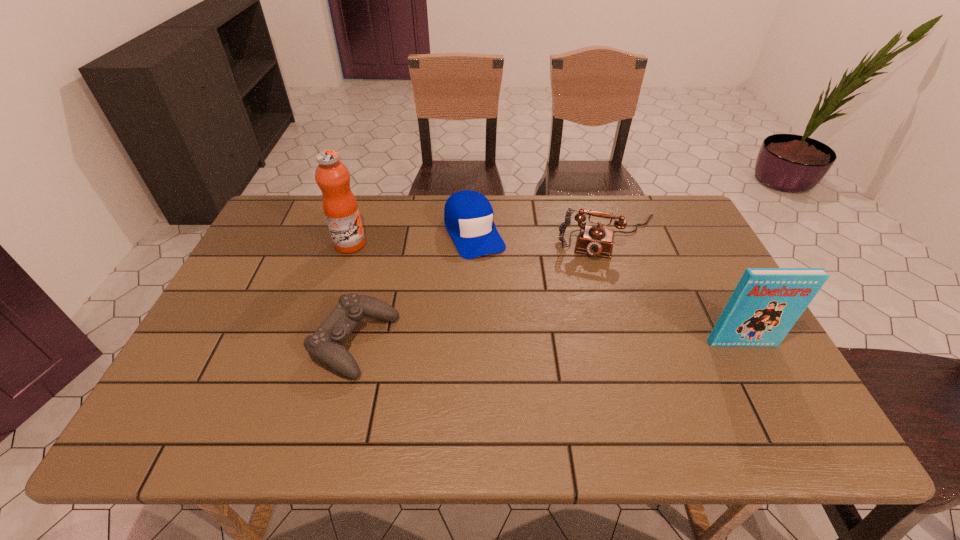
You are a GUI agent. You are given a task and a screenshot of the screen. Output one action in this format:
    pyautogui.click(x=<x>, y=<y>)
    Task: Click on the free space on the desktop that is between the control and the book and is positioned on the dial of the telephone
    This screenshot has width=960, height=540.
    Given the screenshot: What is the action you would take?
    pyautogui.click(x=597, y=343)

The width and height of the screenshot is (960, 540). Find the location of `free spot on the desktop that is between the control and the book and is positioned on the front label of the fruit juice`. free spot on the desktop that is between the control and the book and is positioned on the front label of the fruit juice is located at coordinates (530, 343).

Identify the location of vacant space on the desktop that is between the shortest object and the book and is positioned on the front-facing side of the baseball cap. (533, 343).